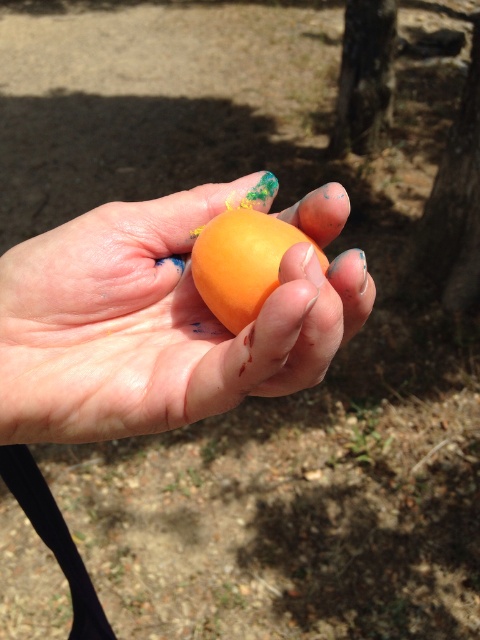
Does point (446, 208) come farther from viewer compared to point (359, 118)?

No, it is not.

Is smooth bark tree at center thinner than smooth bark tree at upper center?

Indeed, smooth bark tree at center has a lesser width compared to smooth bark tree at upper center.

Describe the element at coordinates (455, 192) in the screenshot. I see `smooth bark tree at center` at that location.

This screenshot has width=480, height=640. What are the coordinates of `smooth bark tree at center` in the screenshot? It's located at (455, 192).

Does smooth bark tree at center appear on the right side of orange matte/soft egg at center?

Indeed, smooth bark tree at center is positioned on the right side of orange matte/soft egg at center.

Identify the location of smooth bark tree at center. This screenshot has height=640, width=480. (455, 192).

Is matte orange ball at center above smooth bark tree at center?

No, matte orange ball at center is not above smooth bark tree at center.

Is matte orange ball at center to the left of smooth bark tree at center from the viewer's perspective?

Correct, you'll find matte orange ball at center to the left of smooth bark tree at center.

Between point (242, 342) and point (457, 115), which one is positioned behind?

Positioned behind is point (457, 115).

Identify the location of matte orange ball at center. Image resolution: width=480 pixels, height=640 pixels. (156, 323).